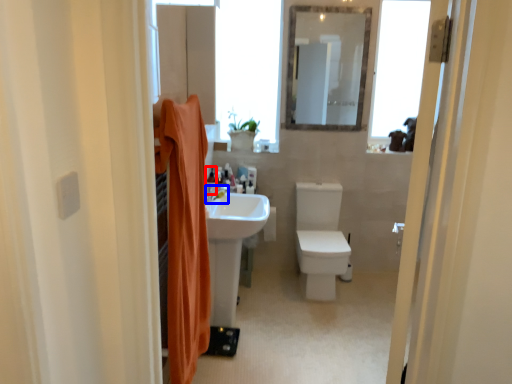
Question: Which object is closer to the camera taking this photo, toiletry (highlighted by a red box) or tap (highlighted by a blue box)?

Choices:
 (A) toiletry
 (B) tap

Answer: (B)